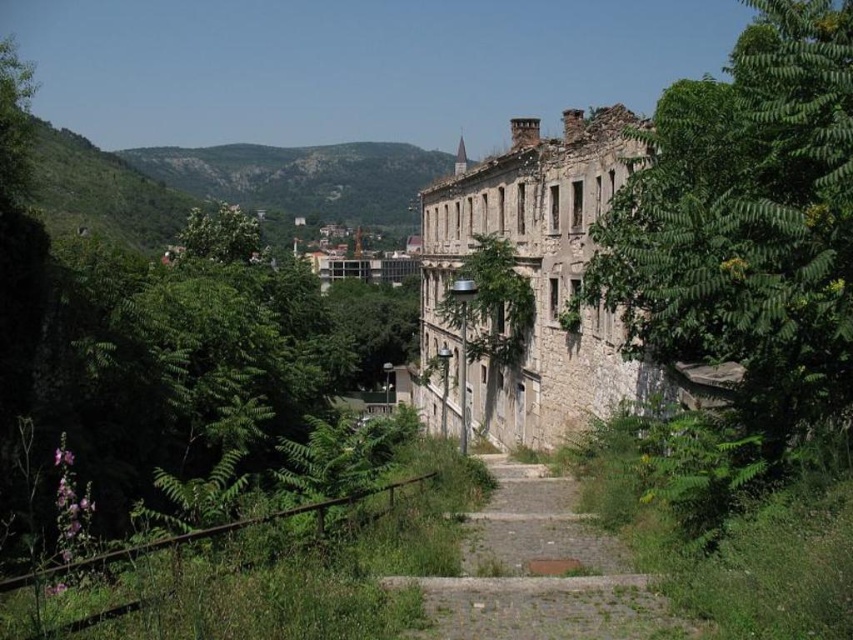
Does dusty stone path at center lie behind green grassy hillside at upper center?

No, dusty stone path at center is closer to the viewer.

Is dusty stone path at center below green grassy hillside at upper center?

Yes.

Where is `dusty stone path at center`? dusty stone path at center is located at coordinates (538, 570).

This screenshot has width=853, height=640. I want to click on dusty stone path at center, so click(538, 570).

Looking at this image, is green leafy tree at right positioned before dusty stone path at center?

Yes, green leafy tree at right is in front of dusty stone path at center.

Between green leafy tree at right and dusty stone path at center, which one is positioned higher?

green leafy tree at right

Locate an element on the screen. This screenshot has height=640, width=853. green leafy tree at right is located at coordinates (747, 221).

Where is `green leafy tree at right`? The width and height of the screenshot is (853, 640). green leafy tree at right is located at coordinates (747, 221).

Which is behind, point (740, 204) or point (428, 177)?

Point (428, 177)

Is green leafy tree at right closer to the viewer compared to green grassy hillside at upper center?

Yes, green leafy tree at right is in front of green grassy hillside at upper center.

The height and width of the screenshot is (640, 853). In order to click on green leafy tree at right in this screenshot , I will do `click(747, 221)`.